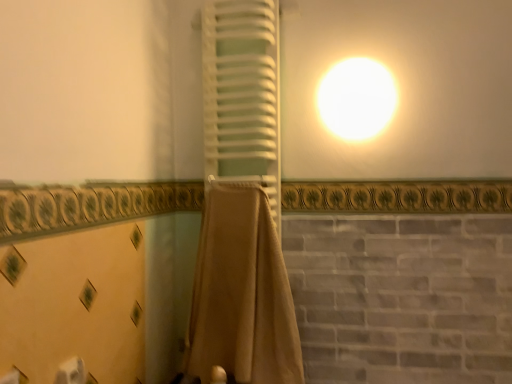
In order to face white matte towel at center, which is the 1th curtain in top-to-bottom order, should I rotate leftwards or rightwards?

You should rotate left by 1.990 degrees.

At what (x,y) coordinates should I click in order to perform the action: click on beige fabric towel at center, which ranks as the second curtain in top-to-bottom order. Please return your answer as a coordinate pair (x, y). The height and width of the screenshot is (384, 512). Looking at the image, I should click on (241, 293).

Find the location of a particular element. The height and width of the screenshot is (384, 512). white matte towel at center, which is the 1th curtain in top-to-bottom order is located at coordinates (240, 87).

Is beige fabric towel at center, which is the first curtain from bottom to top, beside white matte toilet paper at lower left?

No, beige fabric towel at center, which is the first curtain from bottom to top, is not in contact with white matte toilet paper at lower left.

Choose the correct answer: Is beige fabric towel at center, which is the first curtain from bottom to top, inside white matte toilet paper at lower left or outside it?

beige fabric towel at center, which is the first curtain from bottom to top, cannot be found inside white matte toilet paper at lower left.

Is beige fabric towel at center, which is the first curtain from bottom to top, positioned with its back to white matte toilet paper at lower left?

That's not correct — beige fabric towel at center, which is the first curtain from bottom to top, is not looking away from white matte toilet paper at lower left.

From the picture: Which point is more distant from viewer, (293, 349) or (63, 380)?

The point (293, 349) is farther.

From a real-world perspective, is white matte toilet paper at lower left located higher than white matte towel at center, which is the 1th curtain in top-to-bottom order?

Actually, white matte toilet paper at lower left is physically below white matte towel at center, which is the 1th curtain in top-to-bottom order, in the real world.

Would you say white matte towel at center, the 2th curtain positioned from the bottom, is part of white matte toilet paper at lower left's contents?

Definitely not — white matte towel at center, the 2th curtain positioned from the bottom, is not inside white matte toilet paper at lower left.

Relative to white matte towel at center, the 2th curtain positioned from the bottom, is white matte toilet paper at lower left in front or behind?

Visually, white matte toilet paper at lower left is located in front of white matte towel at center, the 2th curtain positioned from the bottom.

Can you see white matte toilet paper at lower left touching beige fabric towel at center, which ranks as the second curtain in top-to-bottom order?

No, white matte toilet paper at lower left is not in contact with beige fabric towel at center, which ranks as the second curtain in top-to-bottom order.

Is beige fabric towel at center, which ranks as the second curtain in top-to-bottom order, located within white matte toilet paper at lower left?

No, beige fabric towel at center, which ranks as the second curtain in top-to-bottom order, is not inside white matte toilet paper at lower left.

From the image's perspective, is white matte toilet paper at lower left on beige fabric towel at center, which is the first curtain from bottom to top?

No.

Image resolution: width=512 pixels, height=384 pixels. I want to click on curtain above the beige fabric towel at center, which is the first curtain from bottom to top (from the image's perspective), so click(240, 87).

From the image's perspective, who appears lower, white matte towel at center, the 2th curtain positioned from the bottom, or beige fabric towel at center, which is the first curtain from bottom to top?

beige fabric towel at center, which is the first curtain from bottom to top, from the image's perspective.

From a real-world perspective, which object rests below the other?

beige fabric towel at center, which ranks as the second curtain in top-to-bottom order, from a real-world perspective.

Is there a large distance between white matte towel at center, which is the 1th curtain in top-to-bottom order, and beige fabric towel at center, which is the first curtain from bottom to top?

white matte towel at center, which is the 1th curtain in top-to-bottom order, is near beige fabric towel at center, which is the first curtain from bottom to top, not far away.

Does beige fabric towel at center, which is the first curtain from bottom to top, appear on the left side of white matte towel at center, which is the 1th curtain in top-to-bottom order?

No, beige fabric towel at center, which is the first curtain from bottom to top, is not to the left of white matte towel at center, which is the 1th curtain in top-to-bottom order.

Is beige fabric towel at center, which ranks as the second curtain in top-to-bottom order, positioned with its back to white matte towel at center, the 2th curtain positioned from the bottom?

No, beige fabric towel at center, which ranks as the second curtain in top-to-bottom order, is not facing the opposite direction of white matte towel at center, the 2th curtain positioned from the bottom.

Would you consider beige fabric towel at center, which is the first curtain from bottom to top, to be distant from white matte towel at center, the 2th curtain positioned from the bottom?

No, there isn't a large distance between beige fabric towel at center, which is the first curtain from bottom to top, and white matte towel at center, the 2th curtain positioned from the bottom.

Does white matte towel at center, which is the 1th curtain in top-to-bottom order, have a lesser width compared to white matte toilet paper at lower left?

Incorrect, the width of white matte towel at center, which is the 1th curtain in top-to-bottom order, is not less than that of white matte toilet paper at lower left.

Is white matte towel at center, the 2th curtain positioned from the bottom, to the right of white matte toilet paper at lower left from the viewer's perspective?

Yes.

Between white matte towel at center, the 2th curtain positioned from the bottom, and white matte toilet paper at lower left, which one has smaller size?

With smaller size is white matte toilet paper at lower left.

From a real-world perspective, which curtain is the 1st one above the white matte toilet paper at lower left? Please provide its 2D coordinates.

[(241, 293)]

The width and height of the screenshot is (512, 384). Find the location of `toilet paper in front of the white matte towel at center, the 2th curtain positioned from the bottom`. toilet paper in front of the white matte towel at center, the 2th curtain positioned from the bottom is located at coordinates (71, 372).

Considering their positions, is beige fabric towel at center, which ranks as the second curtain in top-to-bottom order, positioned closer to white matte toilet paper at lower left than white matte towel at center, the 2th curtain positioned from the bottom?

beige fabric towel at center, which ranks as the second curtain in top-to-bottom order, lies closer to white matte toilet paper at lower left than the other object.

From the image, which object appears to be nearer to white matte towel at center, the 2th curtain positioned from the bottom, white matte toilet paper at lower left or beige fabric towel at center, which ranks as the second curtain in top-to-bottom order?

Among the two, beige fabric towel at center, which ranks as the second curtain in top-to-bottom order, is located nearer to white matte towel at center, the 2th curtain positioned from the bottom.

From the image, which object appears to be nearer to white matte toilet paper at lower left, white matte towel at center, the 2th curtain positioned from the bottom, or beige fabric towel at center, which ranks as the second curtain in top-to-bottom order?

beige fabric towel at center, which ranks as the second curtain in top-to-bottom order, is positioned closer to the anchor white matte toilet paper at lower left.

Looking at the image, which one is located closer to beige fabric towel at center, which ranks as the second curtain in top-to-bottom order, white matte toilet paper at lower left or white matte towel at center, which is the 1th curtain in top-to-bottom order?

white matte towel at center, which is the 1th curtain in top-to-bottom order, lies closer to beige fabric towel at center, which ranks as the second curtain in top-to-bottom order, than the other object.

Which object lies nearer to the anchor point beige fabric towel at center, which is the first curtain from bottom to top, white matte towel at center, which is the 1th curtain in top-to-bottom order, or white matte toilet paper at lower left?

white matte towel at center, which is the 1th curtain in top-to-bottom order, lies closer to beige fabric towel at center, which is the first curtain from bottom to top, than the other object.

When comparing their distances from white matte towel at center, the 2th curtain positioned from the bottom, does beige fabric towel at center, which ranks as the second curtain in top-to-bottom order, or white matte toilet paper at lower left seem further?

white matte toilet paper at lower left is further to white matte towel at center, the 2th curtain positioned from the bottom.

At what (x,y) coordinates should I click in order to perform the action: click on curtain between white matte towel at center, which is the 1th curtain in top-to-bottom order, and white matte toilet paper at lower left from top to bottom. Please return your answer as a coordinate pair (x, y). Looking at the image, I should click on (241, 293).